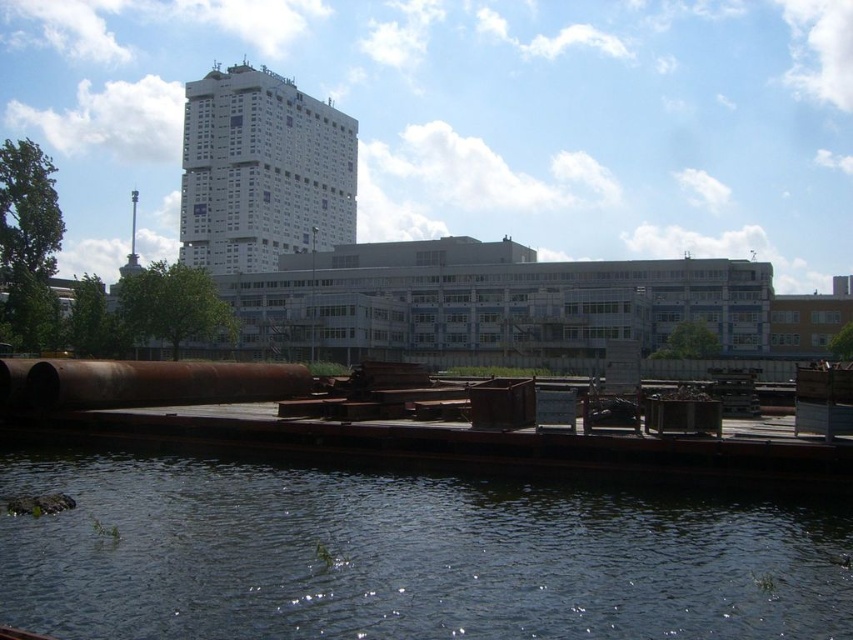
In the scene shown: Which of these two, dark blue water at lower center or rusty metal pipe at lower center, stands taller?

Standing taller between the two is rusty metal pipe at lower center.

From the picture: Is dark blue water at lower center bigger than rusty metal pipe at lower center?

Incorrect, dark blue water at lower center is not larger than rusty metal pipe at lower center.

Is point (15, 624) behind point (160, 392)?

That is False.

Identify the location of dark blue water at lower center. Image resolution: width=853 pixels, height=640 pixels. (405, 554).